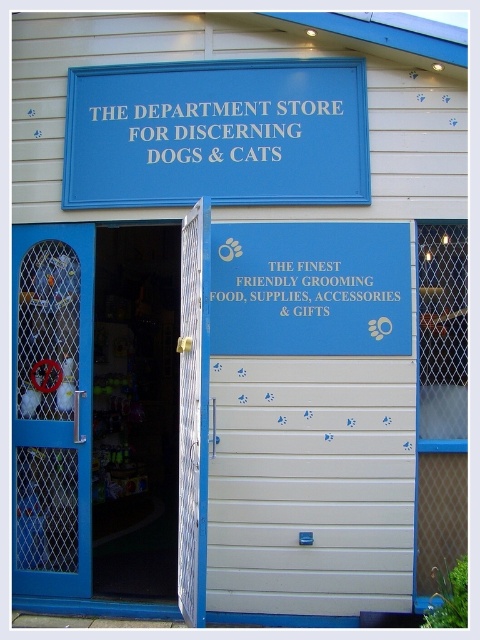
Can you confirm if blue matte sign at center is positioned to the right of blue plastic sign at center?

Correct, you'll find blue matte sign at center to the right of blue plastic sign at center.

Is blue matte sign at center wider than blue plastic sign at center?

Correct, the width of blue matte sign at center exceeds that of blue plastic sign at center.

Who is more distant from viewer, (x=243, y=337) or (x=337, y=308)?

The point (x=243, y=337) is more distant.

Where is `blue matte sign at center`? blue matte sign at center is located at coordinates (311, 289).

Can you confirm if blue plastic sign at upper center is bigger than white plastic sign at upper center?

Yes.

How distant is blue plastic sign at upper center from white plastic sign at upper center?

A distance of 8.99 centimeters exists between blue plastic sign at upper center and white plastic sign at upper center.

Describe the element at coordinates (216, 132) in the screenshot. I see `blue plastic sign at upper center` at that location.

Where is `blue plastic sign at upper center`? The image size is (480, 640). blue plastic sign at upper center is located at coordinates (216, 132).

Between blue plastic sign at upper center and blue matte sign at center, which one appears on the left side from the viewer's perspective?

blue plastic sign at upper center

Between point (252, 67) and point (256, 337), which one is positioned behind?

Positioned behind is point (252, 67).

Who is more forward, (x=162, y=92) or (x=227, y=241)?

Point (x=227, y=241) is more forward.

This screenshot has height=640, width=480. I want to click on blue plastic sign at upper center, so click(216, 132).